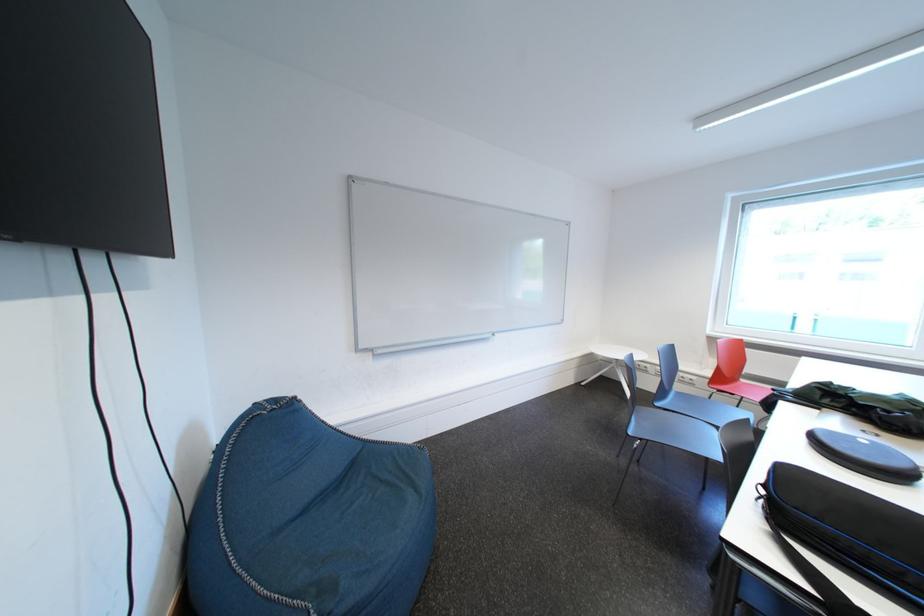
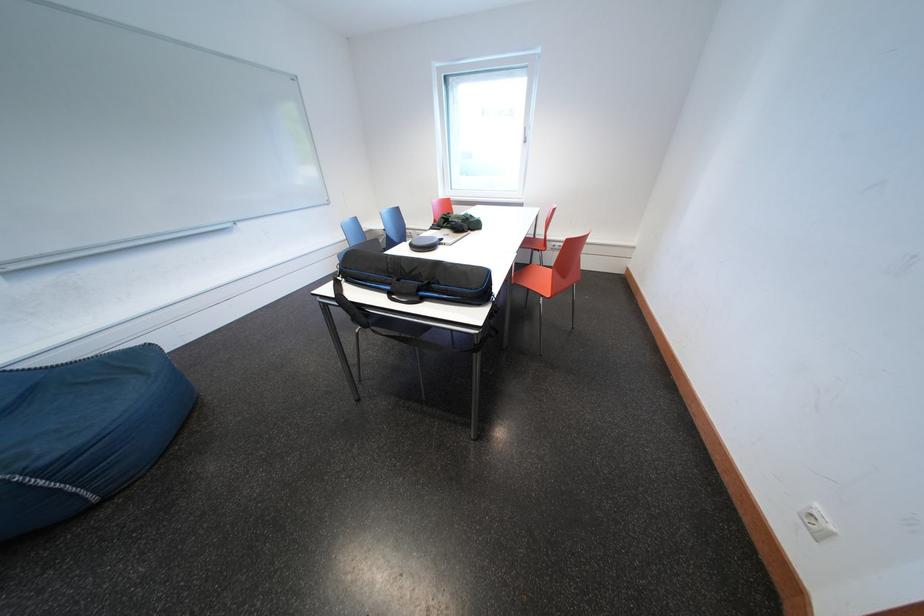
Consider the image. Based on the continuous images, in which direction is the camera rotating?

The rotation direction of the camera is right-down.